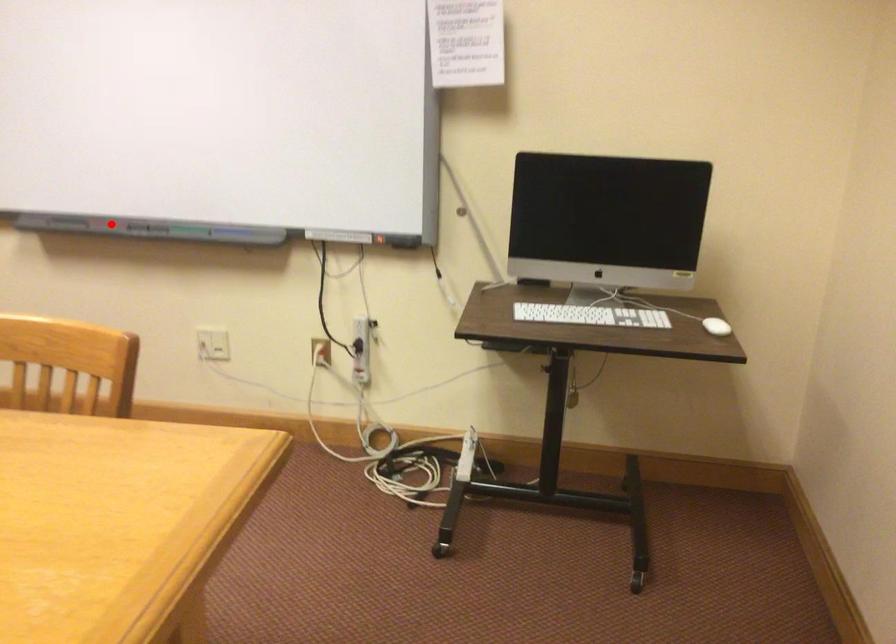
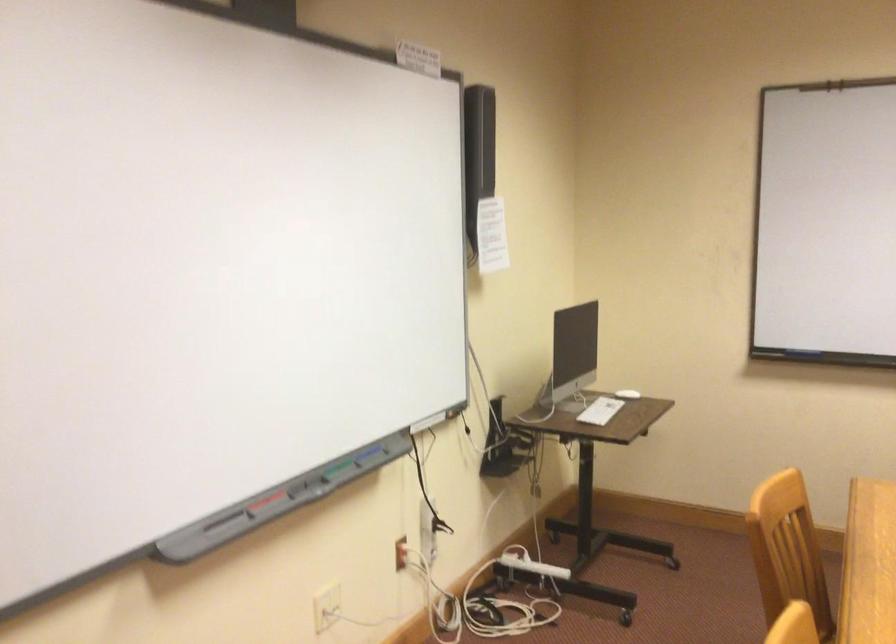
Find the pixel in the second image that matches the highlighted location in the first image.

(264, 502)